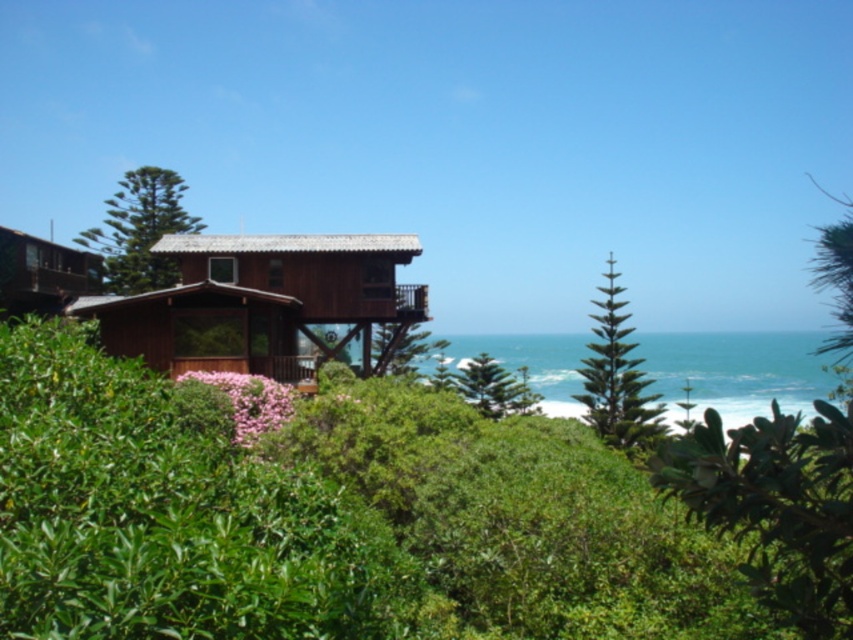
Does green leafy tree at center appear over green textured pine tree at center right?

Yes, green leafy tree at center is above green textured pine tree at center right.

Is green leafy tree at center bigger than green textured pine tree at center right?

Yes, green leafy tree at center is bigger than green textured pine tree at center right.

Between point (733, 442) and point (595, 429), which one is positioned behind?

The point (595, 429) is behind.

Where is `green leafy tree at center`? green leafy tree at center is located at coordinates (775, 506).

Can you confirm if green textured pine tree at upper left is positioned below wooden hut at left?

Actually, green textured pine tree at upper left is above wooden hut at left.

Between green textured pine tree at upper left and wooden hut at left, which one has less height?

With less height is wooden hut at left.

Between point (142, 200) and point (16, 310), which one is positioned behind?

Positioned behind is point (142, 200).

The height and width of the screenshot is (640, 853). What are the coordinates of `green textured pine tree at upper left` in the screenshot? It's located at (140, 230).

Between green textured pine tree at upper left and green textured pine tree at center right, which one appears on the right side from the viewer's perspective?

green textured pine tree at center right

Which is in front, point (131, 182) or point (616, 419)?

Point (616, 419) is in front.

Find the location of a particular element. The image size is (853, 640). green textured pine tree at upper left is located at coordinates (140, 230).